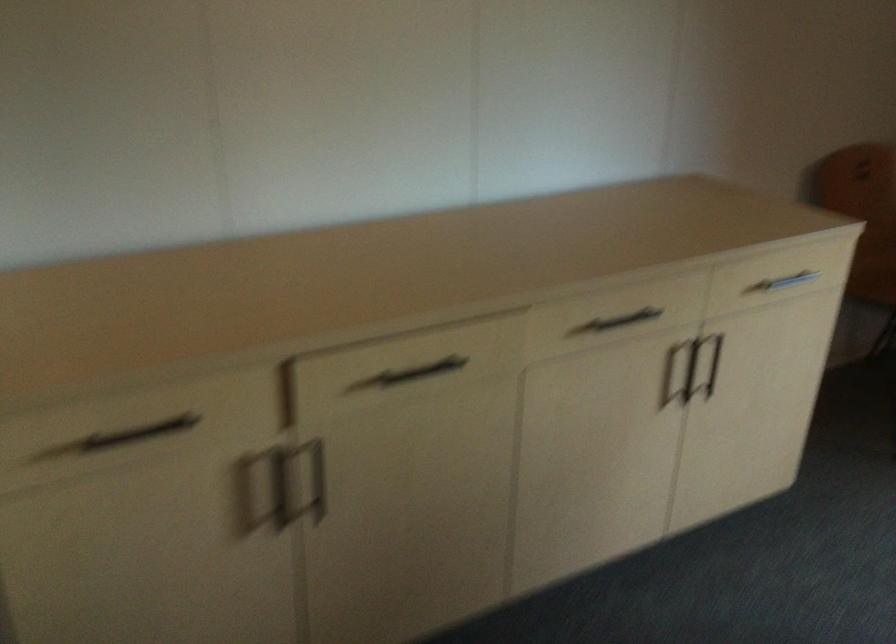
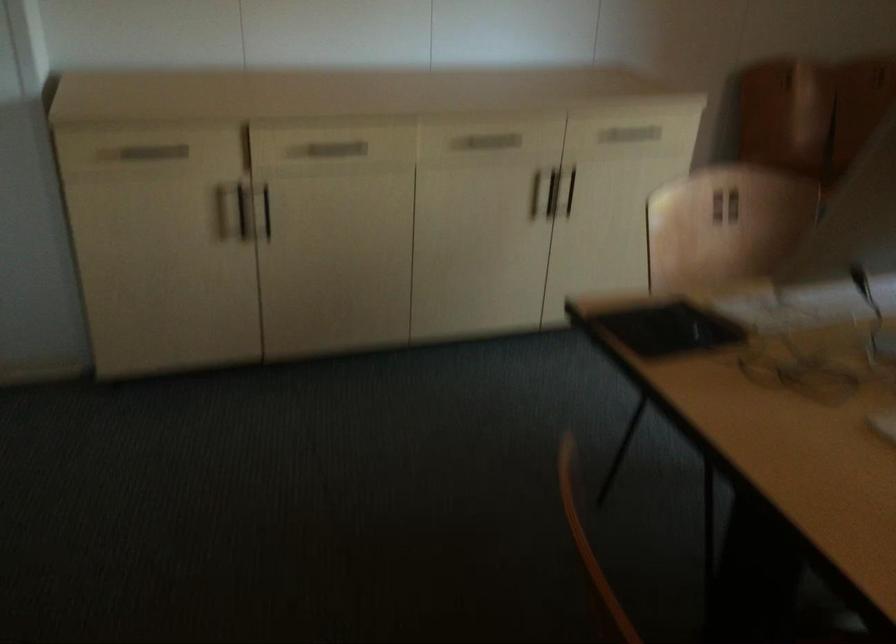
Locate, in the second image, the point that corresponds to point (687, 371) in the first image.

(552, 192)